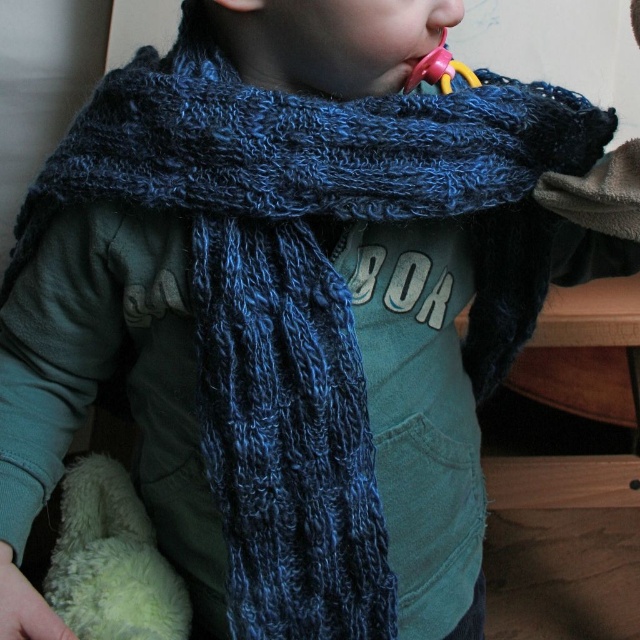
Question: Among these points, which one is farthest from the camera?

Choices:
 (A) (467, 72)
 (B) (452, 10)

Answer: (A)

Question: Observing the image, what is the correct spatial positioning of rubberized yellow and pink toy at mouth in reference to smooth skin nose at upper center?

Choices:
 (A) above
 (B) below

Answer: (B)

Question: Which of the following is the closest to the observer?

Choices:
 (A) smooth skin nose at upper center
 (B) rubberized yellow and pink toy at mouth

Answer: (A)

Question: Is the position of rubberized yellow and pink toy at mouth more distant than that of smooth skin nose at upper center?

Choices:
 (A) yes
 (B) no

Answer: (A)

Question: Can you confirm if rubberized yellow and pink toy at mouth is positioned to the right of smooth skin nose at upper center?

Choices:
 (A) yes
 (B) no

Answer: (A)